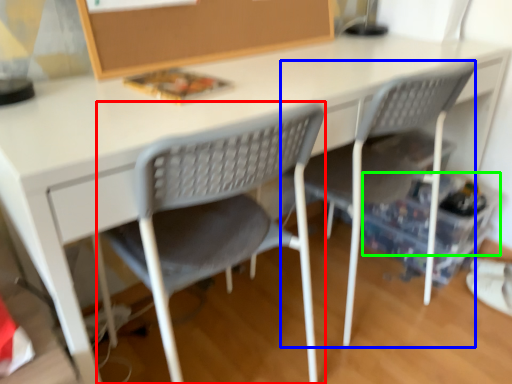
Question: Based on their relative distances, which object is nearer to chair (highlighted by a red box)? Choose from chair (highlighted by a blue box) and storage box (highlighted by a green box).

Choices:
 (A) chair
 (B) storage box

Answer: (A)